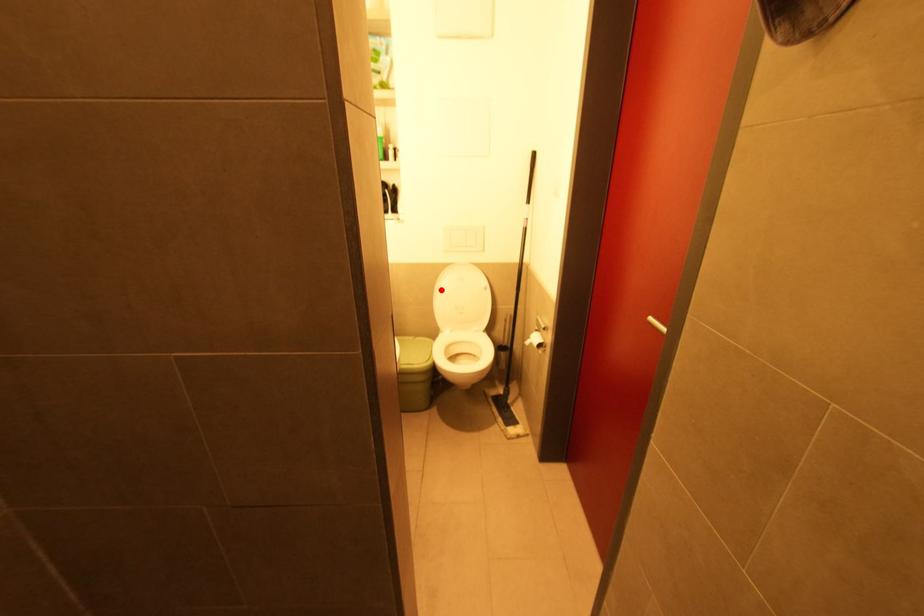
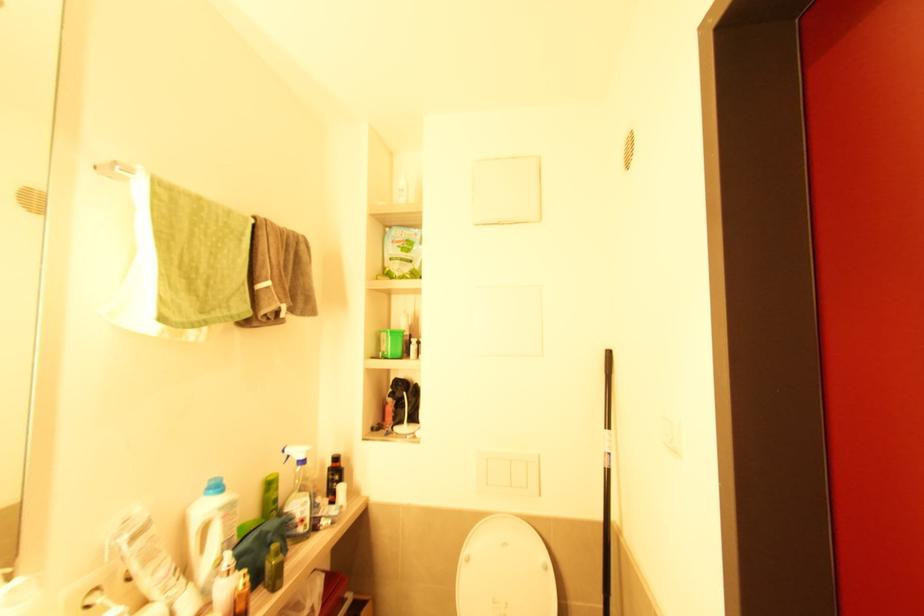
The point at the highlighted location is marked in the first image. Where is the corresponding point in the second image?

(469, 561)